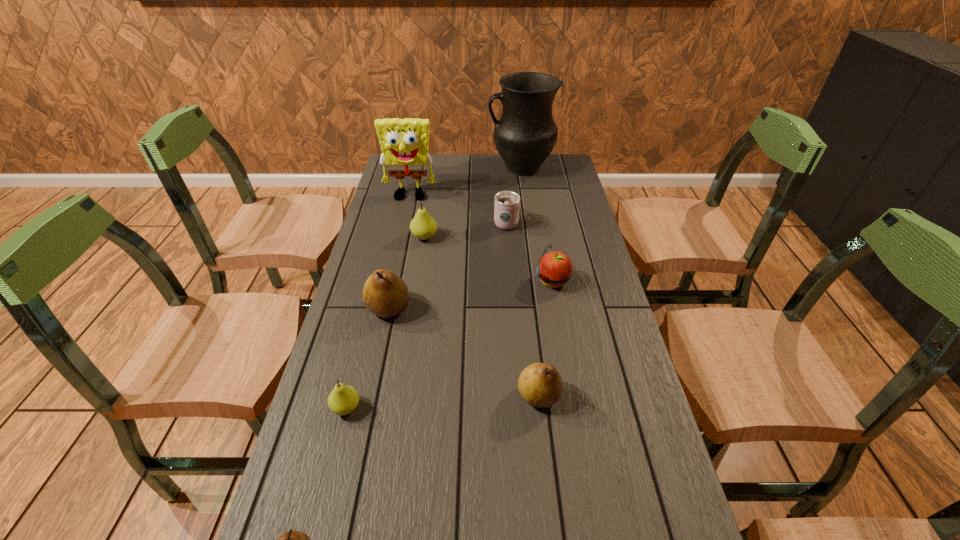
Find the location of a particular element. the second nearest brown pear is located at coordinates [540, 385].

Identify the location of apple. Image resolution: width=960 pixels, height=540 pixels. (555, 269).

This screenshot has width=960, height=540. I want to click on the nearer green pear, so click(343, 399).

You are a GUI agent. You are given a task and a screenshot of the screen. Output one action in this format:
    pyautogui.click(x=<x>, y=<y>)
    Task: Click on the left green pear
    This screenshot has width=960, height=540.
    Given the screenshot: What is the action you would take?
    pyautogui.click(x=343, y=399)

Identify the location of free spot located on the handle side of the black pitcher. This screenshot has height=540, width=960. (473, 168).

Image resolution: width=960 pixels, height=540 pixels. I want to click on free region located 0.130m on the handle side of the black pitcher, so click(456, 168).

The width and height of the screenshot is (960, 540). I want to click on vacant space situated 0.360m on the handle side of the black pitcher, so click(400, 168).

This screenshot has height=540, width=960. In order to click on vacant space located 0.310m on the face of the eighth nearest object in this screenshot , I will do `click(396, 259)`.

Locate an element on the screen. The height and width of the screenshot is (540, 960). vacant space situated on the front of the seventh shortest object is located at coordinates (356, 461).

This screenshot has width=960, height=540. I want to click on vacant space situated 0.070m on the side with the handle of the cup, so click(504, 201).